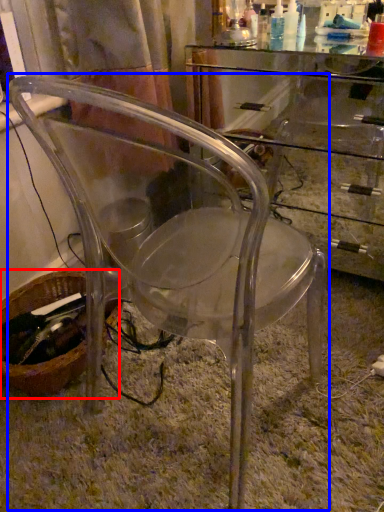
Question: Among these objects, which one is nearest to the camera, basket (highlighted by a red box) or chair (highlighted by a blue box)?

Choices:
 (A) basket
 (B) chair

Answer: (B)